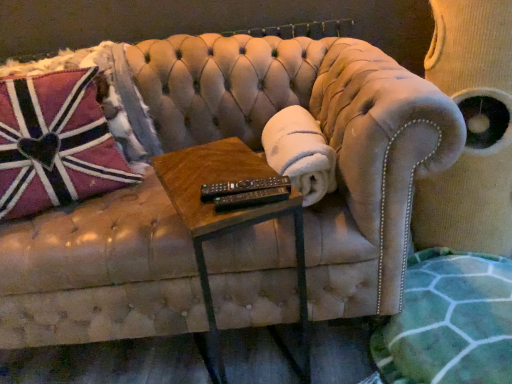
You are a GUI agent. You are given a task and a screenshot of the screen. Output one action in this format:
    pyautogui.click(x=<x>, y=<y>)
    Task: Click on the free space to the back side of black plastic remote at center
    
    Given the screenshot: What is the action you would take?
    pyautogui.click(x=225, y=167)